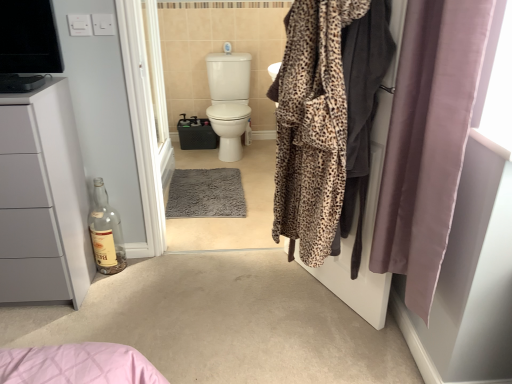
At what (x,y) coordinates should I click in order to perform the action: click on free point to the right of matte white cabinet at left. Please return your answer as a coordinate pair (x, y). Looking at the image, I should click on (128, 295).